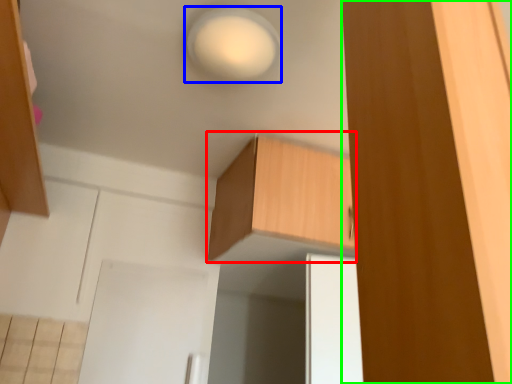
Question: Considering the real-world distances, which object is closest to cabinetry (highlighted by a red box)? light (highlighted by a blue box) or cabinetry (highlighted by a green box).

Choices:
 (A) light
 (B) cabinetry

Answer: (A)